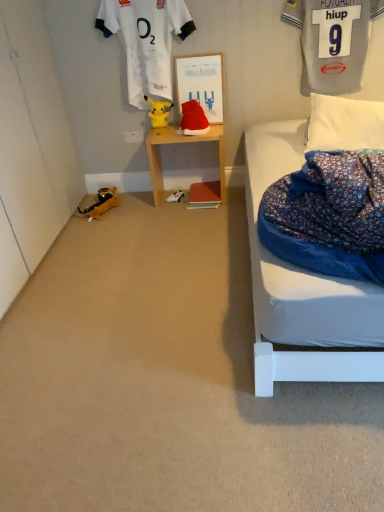
Question: Can you see yellow plush toy at center, the 1th toy in the top-to-bottom sequence, touching white soft pillow at right?

Choices:
 (A) no
 (B) yes

Answer: (A)

Question: Considering the relative sizes of yellow plush toy at center, the 3th toy when ordered from bottom to top, and white soft pillow at right in the image provided, is yellow plush toy at center, the 3th toy when ordered from bottom to top, taller than white soft pillow at right?

Choices:
 (A) yes
 (B) no

Answer: (B)

Question: Is yellow plush toy at center, positioned as the 2th toy in right-to-left order, not within white soft pillow at right?

Choices:
 (A) no
 (B) yes

Answer: (B)

Question: From a real-world perspective, does yellow plush toy at center, the 2th toy viewed from the left, stand above white soft pillow at right?

Choices:
 (A) no
 (B) yes

Answer: (B)

Question: Is yellow plush toy at center, positioned as the 2th toy in right-to-left order, looking in the opposite direction of white soft pillow at right?

Choices:
 (A) no
 (B) yes

Answer: (A)

Question: In terms of height, does white soft pillow at right look taller or shorter compared to velvet red santa hat at center, marked as the 2th toy in a top-to-bottom arrangement?

Choices:
 (A) tall
 (B) short

Answer: (A)

Question: In the image, is white soft pillow at right on the left side or the right side of velvet red santa hat at center, acting as the 1th toy starting from the right?

Choices:
 (A) right
 (B) left

Answer: (A)

Question: Would you say white soft pillow at right is inside or outside velvet red santa hat at center, marked as the 2th toy in a top-to-bottom arrangement?

Choices:
 (A) outside
 (B) inside

Answer: (A)

Question: Is white soft pillow at right bigger or smaller than velvet red santa hat at center, placed as the third toy when sorted from left to right?

Choices:
 (A) big
 (B) small

Answer: (A)

Question: From a real-world perspective, is velvet red santa hat at center, the 2th toy in the bottom-to-top sequence, physically located above or below white plastic power outlet at lower center?

Choices:
 (A) above
 (B) below

Answer: (A)

Question: Looking at the image, does velvet red santa hat at center, acting as the 1th toy starting from the right, seem bigger or smaller compared to white plastic power outlet at lower center?

Choices:
 (A) big
 (B) small

Answer: (A)

Question: Is point (188, 123) positioned closer to the camera than point (125, 131)?

Choices:
 (A) closer
 (B) farther

Answer: (A)

Question: Do you think velvet red santa hat at center, acting as the 1th toy starting from the right, is within white plastic power outlet at lower center, or outside of it?

Choices:
 (A) outside
 (B) inside

Answer: (A)

Question: From their relative heights in the image, would you say velvet red santa hat at center, placed as the third toy when sorted from left to right, is taller or shorter than gray jersey at upper right, which is counted as the first clothing, starting from the right?

Choices:
 (A) short
 (B) tall

Answer: (A)

Question: In the image, is velvet red santa hat at center, marked as the 2th toy in a top-to-bottom arrangement, on the left side or the right side of gray jersey at upper right, which is counted as the first clothing, starting from the right?

Choices:
 (A) left
 (B) right

Answer: (A)